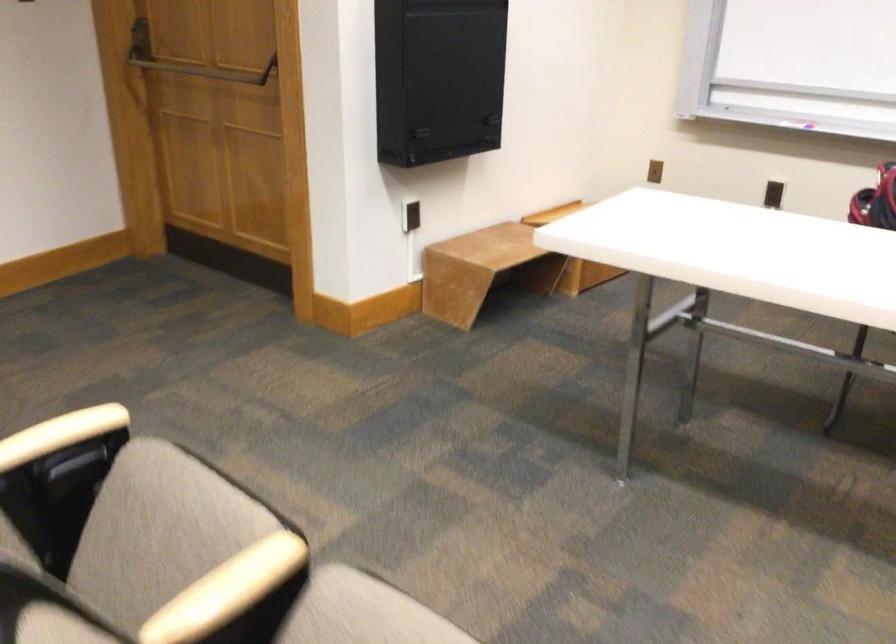
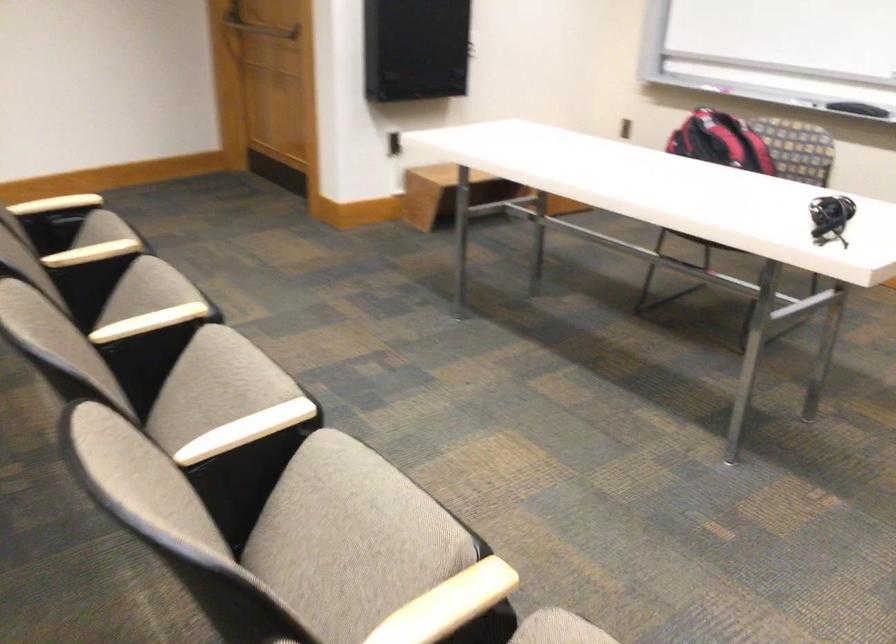
The point at (205, 87) is marked in the first image. Where is the corresponding point in the second image?

(261, 29)